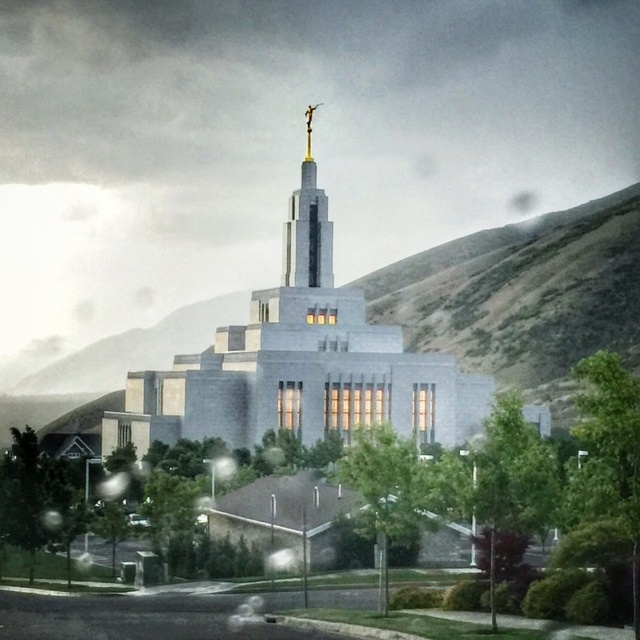
You are a visitor standing at the entrance of the temple. You see the green leafy tree at center and the gold polished spire at center. Which object appears wider from your perspective?

The green leafy tree at center has a lesser width compared to the gold polished spire at center, so the gold polished spire at center appears wider.

You are planning to take a photo of the white stone church at center and the green leafy tree at lower left from a distance. Which object will appear wider in the photo?

The white stone church at center will appear wider in the photo because its width is larger than that of the green leafy tree at lower left.

You are standing at the entrance of the temple complex and want to take a photo that captures both the white stone church at center and the green leafy tree at lower left. Since you want to ensure both are in focus, which object should you position closer to the camera to achieve this?

The white stone church at center is taller than the green leafy tree at lower left. To have both in focus, position the taller white stone church at center closer to the camera so that the distance between the two objects is minimized.